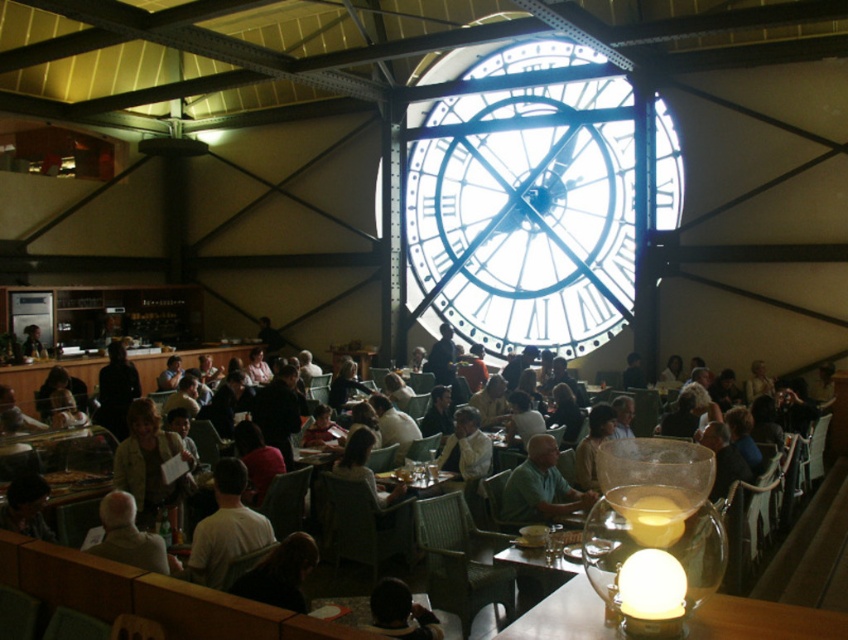
You are standing at the entrance of the modern cafe and want to walk towards the large clock face on the wall. There are two points marked as point 1 at coordinates point (790, 627) and point 2 at coordinates point (271, 604). Which point should you aim for to reach the clock face first?

Point (790, 627) is in front of point (271, 604), so you should aim for point (790, 627) to reach the clock face first.

From the picture: You are standing in the modern cafe and want to locate the transparent glass clock at center. According to the coordinates provided, where would you look?

You should look at point (525, 212) to find the transparent glass clock at center.

You are a customer sitting at a table in the middle of the modern cafe. You notice two items of clothing nearby. One is the matte black jacket at center and the other is the dark gray sweater at lower center. Which clothing item is positioned higher up in the scene?

The matte black jacket at center is located above the dark gray sweater at lower center, so it is positioned higher up in the scene.